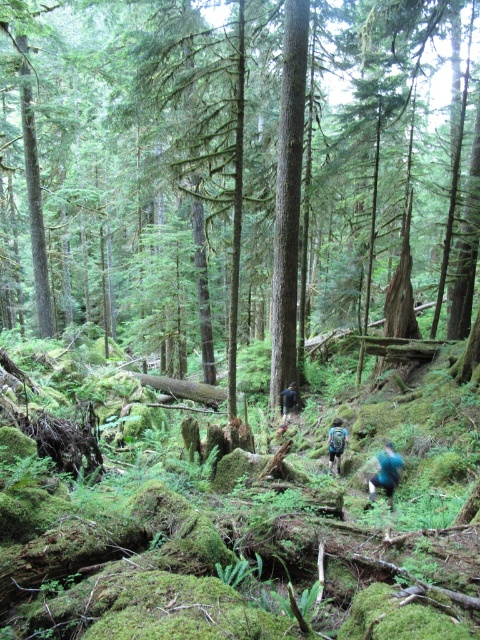
You are hiking in the forest and see a green mossy tree at center and a blue fabric backpack at center. Which object is bigger?

The green mossy tree at center is larger in size than the blue fabric backpack at center.

Based on the photo, you are a hiker who has just spotted a green mossy tree at center and a dark blue backpack at center in the forest. You want to know if you can fit both items side by side without overlapping. Can you determine which item has a greater width?

The green mossy tree at center has a greater width than the dark blue backpack at center, so they can be placed side by side without overlapping as long as there is enough space for both.